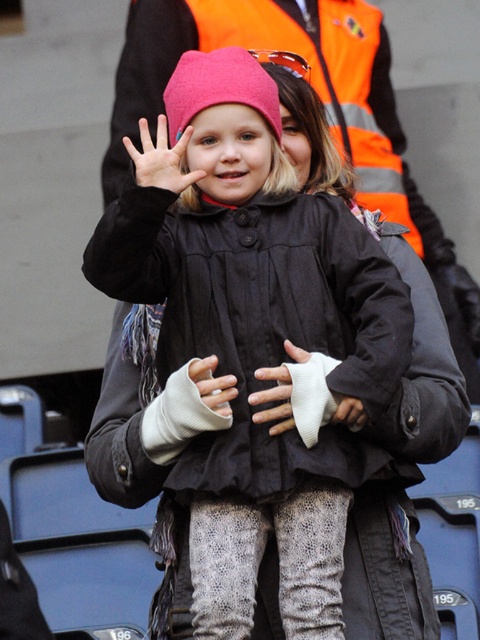
Question: Which point is closer to the camera taking this photo?

Choices:
 (A) (262, 413)
 (B) (194, 364)
 (C) (244, 548)

Answer: (C)

Question: Which object is positioned closest to the pink fabric hat at center?

Choices:
 (A) white cotton glove at center
 (B) matte black jacket at center
 (C) white woolen glove at center
 (D) matte pink beanie at upper center

Answer: (D)

Question: Among these points, which one is farthest from the camera?

Choices:
 (A) (160, 156)
 (B) (211, 358)
 (C) (200, 508)
 (D) (217, 60)

Answer: (D)

Question: Can you confirm if white cotton glove at center is smaller than matte pink beanie at upper center?

Choices:
 (A) no
 (B) yes

Answer: (B)

Question: Is pink fabric hat at center closer to the viewer compared to matte pink beanie at upper center?

Choices:
 (A) no
 (B) yes

Answer: (A)

Question: Can you confirm if white cotton glove at center is smaller than white woolen glove at center?

Choices:
 (A) no
 (B) yes

Answer: (A)